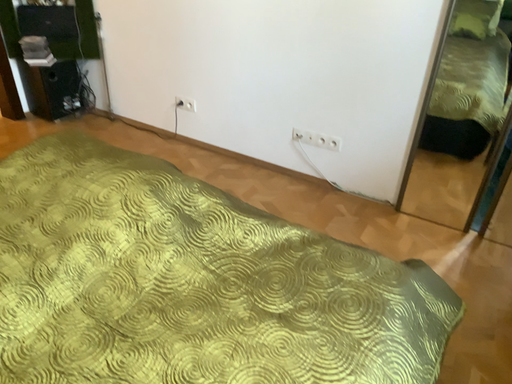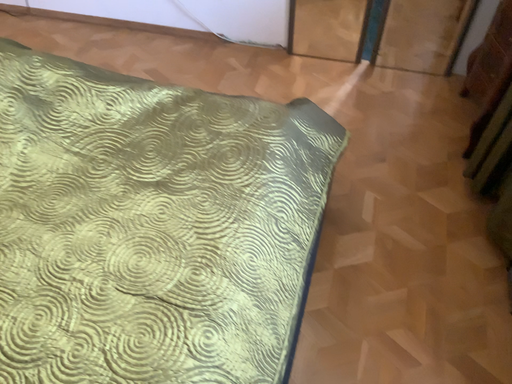
Question: Which way did the camera rotate in the video?

Choices:
 (A) rotated right
 (B) rotated left

Answer: (A)